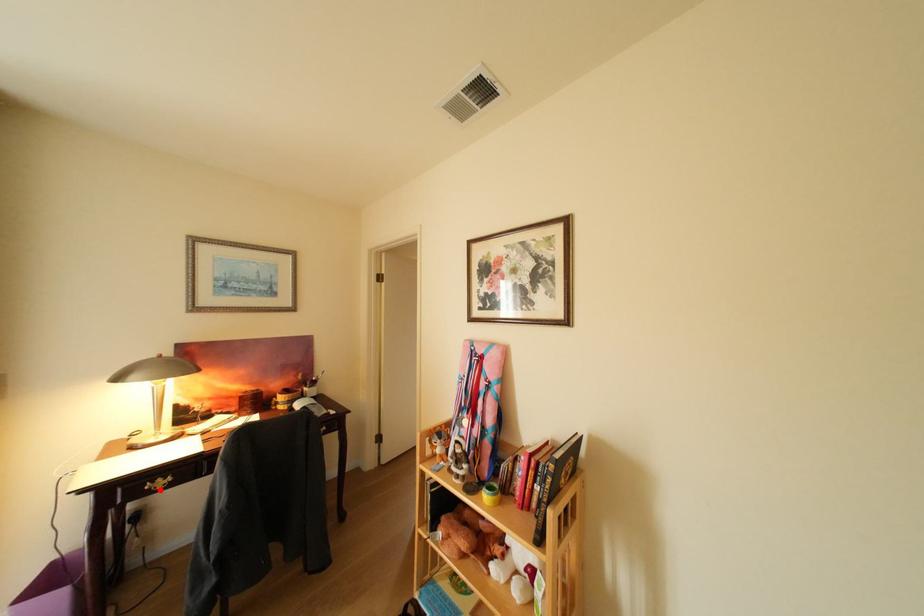
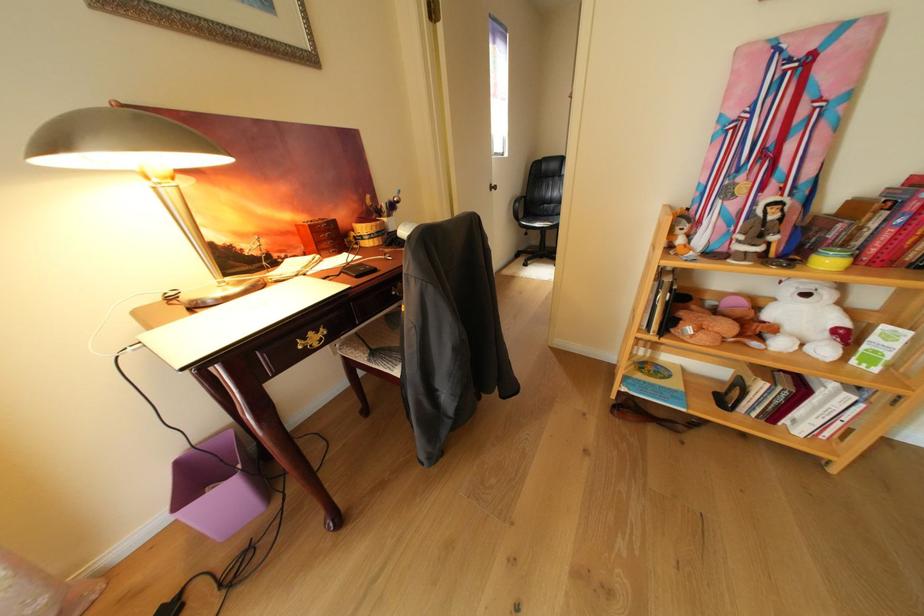
Question: I am providing you with two images of the same scene from different viewpoints. A red point is shown in image1. For the corresponding object point in image2, is it positioned nearer or farther from the camera?

Choices:
 (A) Nearer
 (B) Farther

Answer: (A)